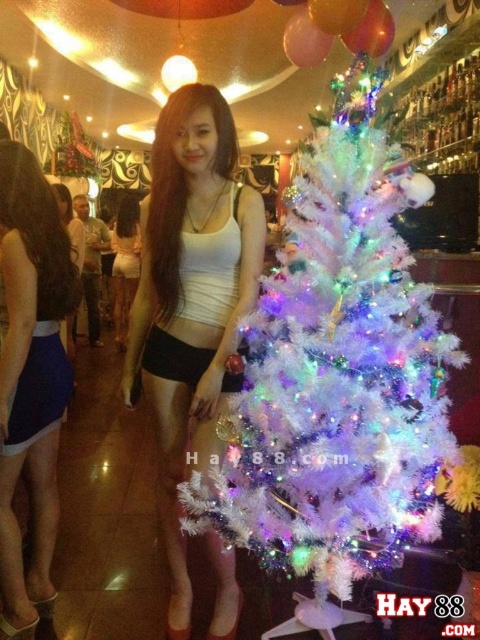
You are standing in the festive bar area and want to place a decoration between the two points, point (419, 346) and point (235, 273). Which point should the decoration be closer to in order to appear closer to the viewer?

The decoration should be placed closer to point (419, 346) because it is closer to the viewer than point (235, 273).

You are a photographer setting up for a photoshoot in this festive bar. You need to ensure that the white matte tank top at center and the blue satin skirt at lower left are both visible in the frame. Considering their heights, which one might require you to adjust your camera angle to capture fully?

The white matte tank top at center is much taller than the blue satin skirt at lower left, so you might need to adjust the camera angle to ensure the taller white matte tank top at center is fully captured in the frame.

You are standing in the festive bar area and want to place a new decoration. You have two points marked on the wall where you can hang it. The first point is at coordinate point(271,323) and the second point is at coordinate point(31,560). Which point is closer to you?

Point(271,323) is closer to the viewer than point(31,560).